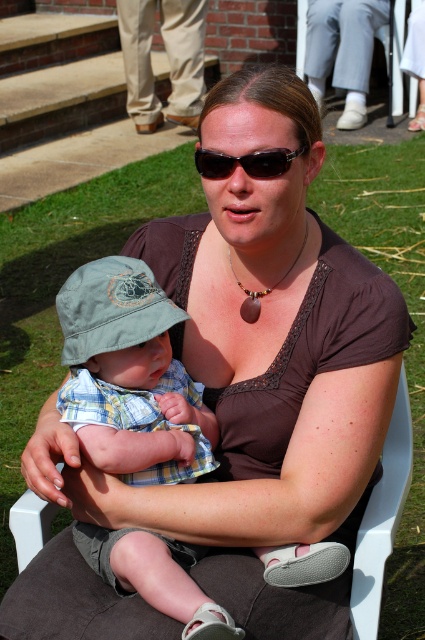
You are planning to place a small decorative item on the white plastic chair at center. Considering the size of the chair and the pendant, will the brown stone pendant at center fit comfortably on the chair without falling off?

The white plastic chair at center is larger than the brown stone pendant at center, so the pendant will fit comfortably on the chair without any issues.

You are standing in the outdoor scene described. Where is the white plastic chair at center located in terms of coordinates?

The white plastic chair at center is located at point coordinates of (382, 518).

You are standing in the outdoor area and want to place a small potted plant between the white plastic chair at center and the brown stone pendant at center. Based on their positions, which object should the plant be closer to?

The white plastic chair at center is in front of the brown stone pendant at center, so the plant should be placed closer to the brown stone pendant at center to maintain a balanced arrangement.